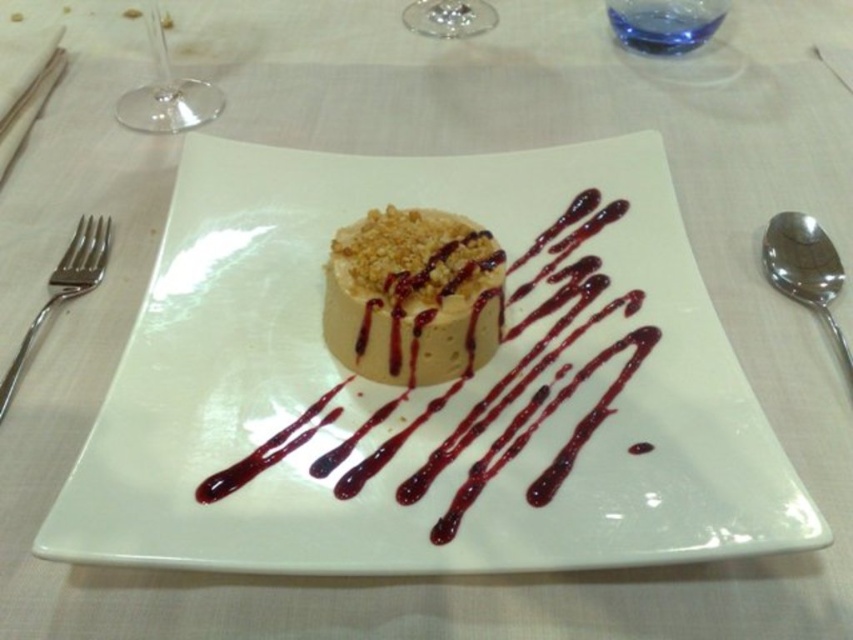
You are a food stylist arranging this dessert. The client wants to ensure the matte brown mousse at center and transparent glass wine glass at upper left are proportionally balanced. Given their sizes, which object should be placed closer to the edge of the plate to maintain visual harmony?

The transparent glass wine glass at upper left should be placed closer to the edge of the plate since it is smaller in size compared to the matte brown mousse at center, which is larger. This balance helps maintain visual harmony.

You are a food critic who wants to taste the smooth caramel cake at center. The satin silver fork at left is your only utensil. Can you use the fork to reach the cake without moving the plate?

The smooth caramel cake at center is positioned on the right side of the satin silver fork at left, so yes, the fork can reach the cake by moving towards the right side of the fork.

You are a food critic who needs to taste the smooth caramel cake at center. The satin silver fork at left is the only utensil available. Can you use the fork to reach the top of the cake without bending down?

The smooth caramel cake at center is not as tall as the satin silver fork at left, so the fork is taller than the cake. Therefore, you can use the fork to reach the top of the cake without bending down.